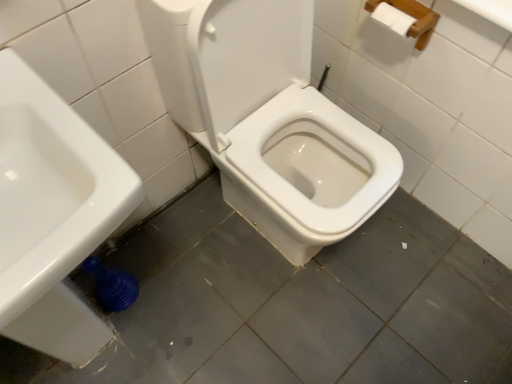
Question: Is white glossy sink at lower left situated inside white glossy toilet at center or outside?

Choices:
 (A) outside
 (B) inside

Answer: (A)

Question: From a real-world perspective, is white glossy sink at lower left positioned above or below white glossy toilet at center?

Choices:
 (A) below
 (B) above

Answer: (B)

Question: Is white glossy sink at lower left wider or thinner than white glossy toilet at center?

Choices:
 (A) wide
 (B) thin

Answer: (B)

Question: From a real-world perspective, relative to white glossy sink at lower left, is white glossy toilet at center vertically above or below?

Choices:
 (A) below
 (B) above

Answer: (A)

Question: Is white glossy toilet at center in front of or behind white glossy sink at lower left in the image?

Choices:
 (A) behind
 (B) front

Answer: (A)

Question: Based on their sizes in the image, would you say white glossy toilet at center is bigger or smaller than white glossy sink at lower left?

Choices:
 (A) small
 (B) big

Answer: (A)

Question: Considering the positions of white glossy toilet at center and white glossy sink at lower left in the image, is white glossy toilet at center wider or thinner than white glossy sink at lower left?

Choices:
 (A) thin
 (B) wide

Answer: (B)